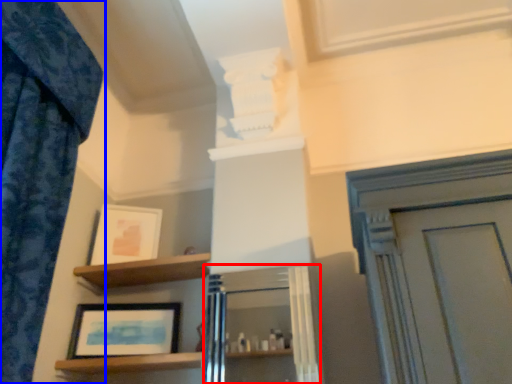
Question: Among these objects, which one is nearest to the camera, cabinetry (highlighted by a red box) or curtain (highlighted by a blue box)?

Choices:
 (A) cabinetry
 (B) curtain

Answer: (B)